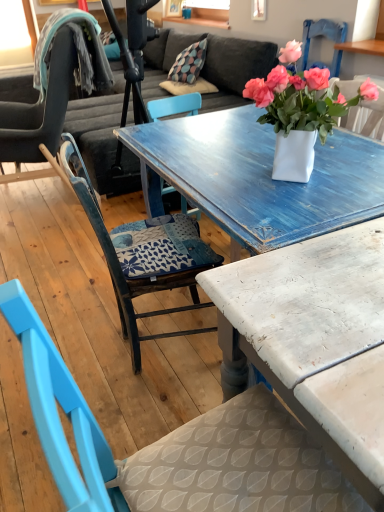
Question: From the image's perspective, would you say matte blue chair at left, which is counted as the 3th chair, starting from the front, is positioned over blue painted wood chair at center, acting as the third chair starting from the left?

Choices:
 (A) no
 (B) yes

Answer: (B)

Question: Considering the relative sizes of matte blue chair at left, which appears as the 1th chair when viewed from the left, and blue painted wood chair at center, acting as the third chair starting from the left, in the image provided, is matte blue chair at left, which appears as the 1th chair when viewed from the left, shorter than blue painted wood chair at center, acting as the third chair starting from the left,?

Choices:
 (A) yes
 (B) no

Answer: (B)

Question: Can you confirm if matte blue chair at left, which appears as the 1th chair when viewed from the left, is smaller than blue painted wood chair at center, positioned as the 3th chair in back-to-front order?

Choices:
 (A) yes
 (B) no

Answer: (B)

Question: Can you confirm if matte blue chair at left, which appears as the 1th chair when viewed from the left, is wider than blue painted wood chair at center, positioned as the 3th chair in back-to-front order?

Choices:
 (A) yes
 (B) no

Answer: (A)

Question: Does matte blue chair at left, the first chair viewed from the back, have a greater height compared to blue painted wood chair at center, acting as the third chair starting from the left?

Choices:
 (A) no
 (B) yes

Answer: (B)

Question: Is matte blue chair at left, which is counted as the 3th chair, starting from the front, far from blue painted wood chair at center, which is counted as the 1th chair, starting from the right?

Choices:
 (A) no
 (B) yes

Answer: (B)

Question: From the image's perspective, is distressed white table at center below matte blue chair at left, marked as the 3th chair in a right-to-left arrangement?

Choices:
 (A) yes
 (B) no

Answer: (A)

Question: Is matte blue chair at left, which appears as the 1th chair when viewed from the left, completely or partially inside distressed white table at center?

Choices:
 (A) no
 (B) yes

Answer: (A)

Question: Is distressed white table at center positioned far away from matte blue chair at left, which is counted as the 3th chair, starting from the front?

Choices:
 (A) yes
 (B) no

Answer: (A)

Question: Is distressed white table at center completely or partially outside of matte blue chair at left, marked as the 3th chair in a right-to-left arrangement?

Choices:
 (A) no
 (B) yes

Answer: (B)

Question: Does distressed white table at center have a smaller size compared to matte blue chair at left, which appears as the 1th chair when viewed from the left?

Choices:
 (A) yes
 (B) no

Answer: (A)

Question: Considering the relative positions of distressed white table at center and matte blue chair at left, marked as the 3th chair in a right-to-left arrangement, in the image provided, is distressed white table at center in front of matte blue chair at left, marked as the 3th chair in a right-to-left arrangement,?

Choices:
 (A) yes
 (B) no

Answer: (A)

Question: Does blue painted wood chair at center, which is counted as the 1th chair, starting from the front, have a greater height compared to matte blue chair at left, which is counted as the 3th chair, starting from the front?

Choices:
 (A) no
 (B) yes

Answer: (A)